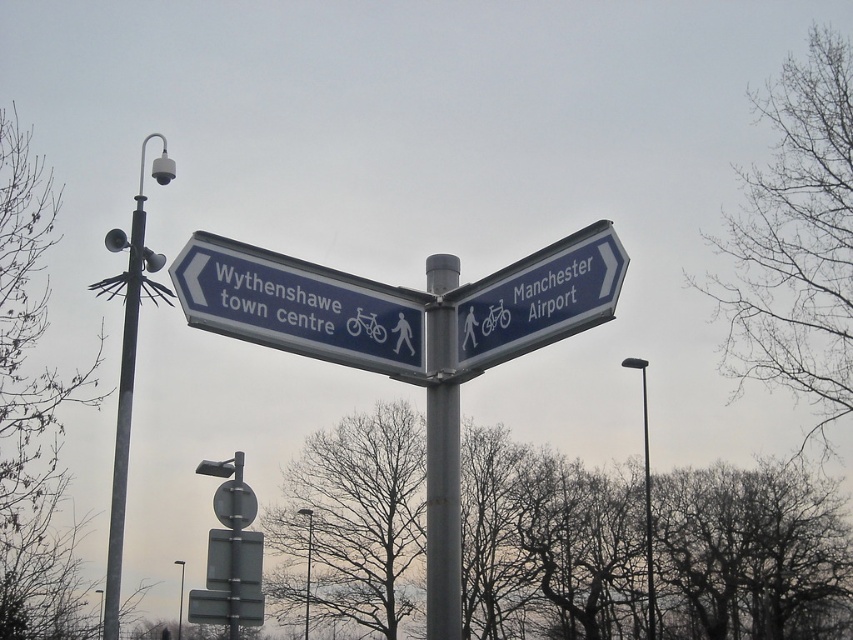
You are a pedestrian standing in front of the signpost. You notice the bare branches at center and the metallic pole at center. Which one is wider?

The bare branches at center are wider than the metallic pole at center.

You are a pedestrian trying to read the blue plastic sign at upper left and the bare branches at upper right. Which object is closer to you?

The bare branches at upper right are closer to you because the blue plastic sign at upper left is behind them.